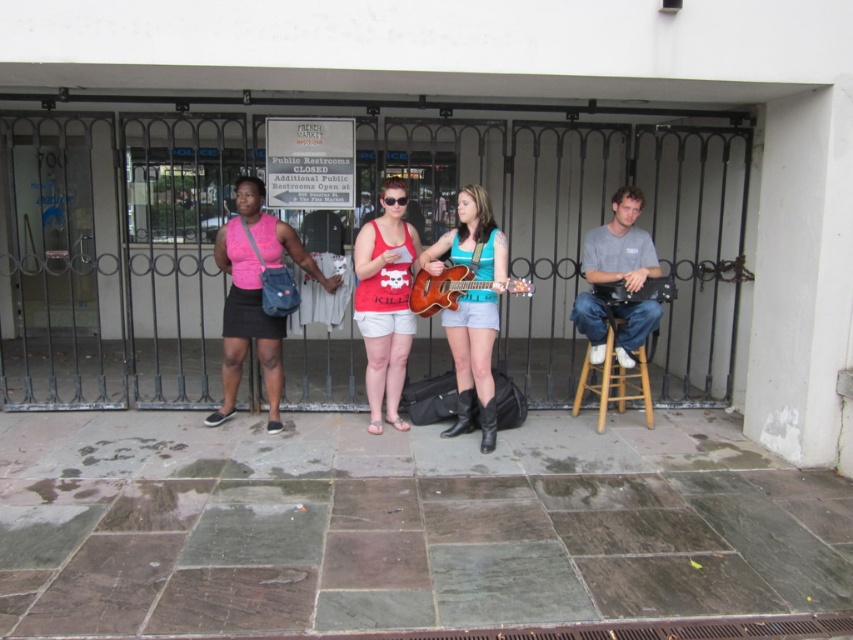
Question: Is the position of matte red tank top at center more distant than that of wooden stool at right?

Choices:
 (A) no
 (B) yes

Answer: (A)

Question: Estimate the real-world distances between objects in this image. Which object is farther from the matte red tank top at center?

Choices:
 (A) matte blue denim shorts at center
 (B) transparent plastic goggles at center
 (C) gray cotton shirt at center

Answer: (C)

Question: Among these points, which one is nearest to the camera?

Choices:
 (A) (355, 250)
 (B) (610, 305)
 (C) (642, 273)

Answer: (C)

Question: Observing the image, what is the correct spatial positioning of brown wooden guitar at center in reference to transparent plastic goggles at center?

Choices:
 (A) above
 (B) below

Answer: (B)

Question: Which of the following is the closest to the observer?

Choices:
 (A) (459, 262)
 (B) (381, 371)
 (C) (614, 291)

Answer: (A)

Question: In this image, where is matte red tank top at center located relative to wooden acoustic guitar at center?

Choices:
 (A) below
 (B) above

Answer: (A)